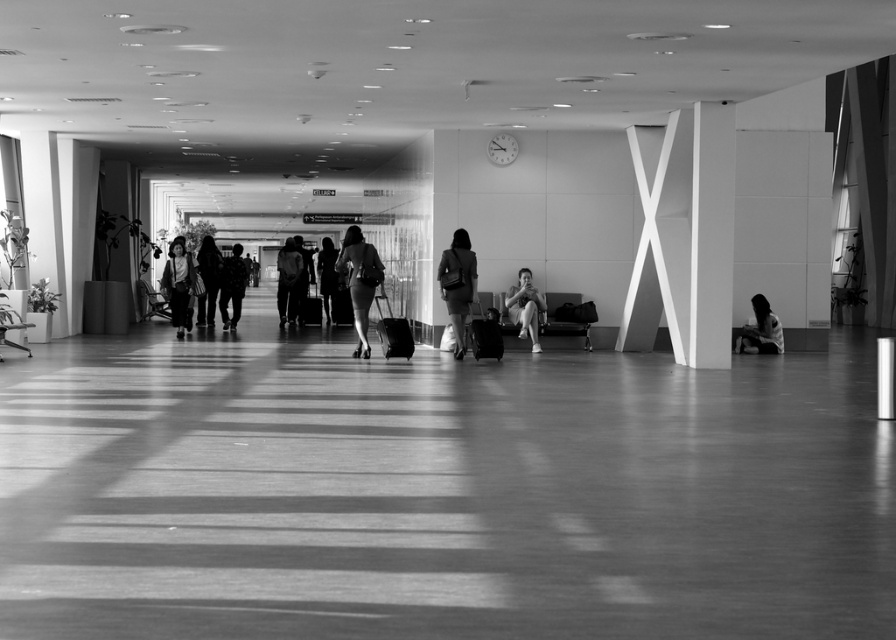
Question: Can you confirm if matte black suitcase at center is bigger than silhouette fabric dress at center?

Choices:
 (A) no
 (B) yes

Answer: (A)

Question: Among these objects, which one is farthest from the camera?

Choices:
 (A) smooth skin person at center
 (B) matte black suitcase at center
 (C) flannel shirt at center

Answer: (B)

Question: From the image, what is the correct spatial relationship of matte black dress at center in relation to matte black jacket at left?

Choices:
 (A) below
 (B) above

Answer: (B)

Question: Which object is closer to the camera taking this photo?

Choices:
 (A) smooth skin person at lower right
 (B) matte black bag at center
 (C) flannel shirt at center
 (D) smooth black dress at center

Answer: (B)

Question: Is white matte pillar at right smaller than smooth skin person at lower right?

Choices:
 (A) yes
 (B) no

Answer: (B)

Question: Which point appears closest to the camera in this image?

Choices:
 (A) (359, 355)
 (B) (504, 307)
 (C) (754, 339)

Answer: (A)